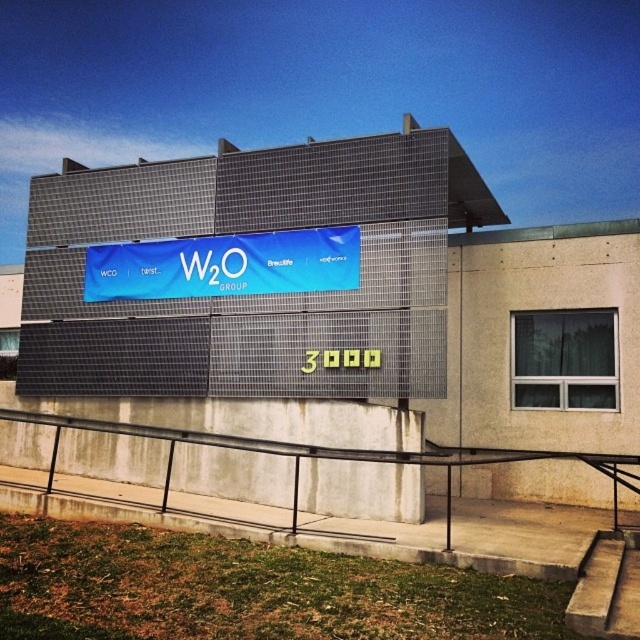
You are standing on the walkway and want to reach the entrance located to the right of the black metal railing at lower center. Which direction should you move relative to the blue fabric banner at center?

You should move to the right of the blue fabric banner at center because the black metal railing at lower center is positioned to the right of the blue fabric banner at center, and the entrance is to the right of the railing.